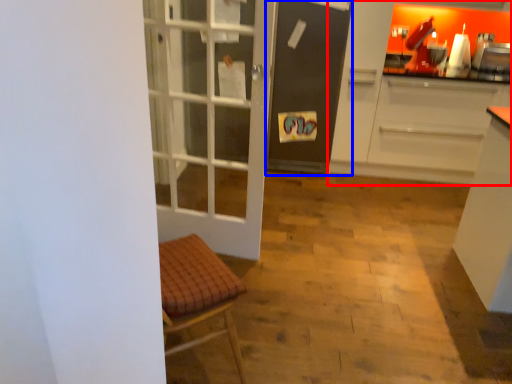
Question: Which of the following is the farthest to the observer, cabinetry (highlighted by a red box) or screen door (highlighted by a blue box)?

Choices:
 (A) cabinetry
 (B) screen door

Answer: (B)